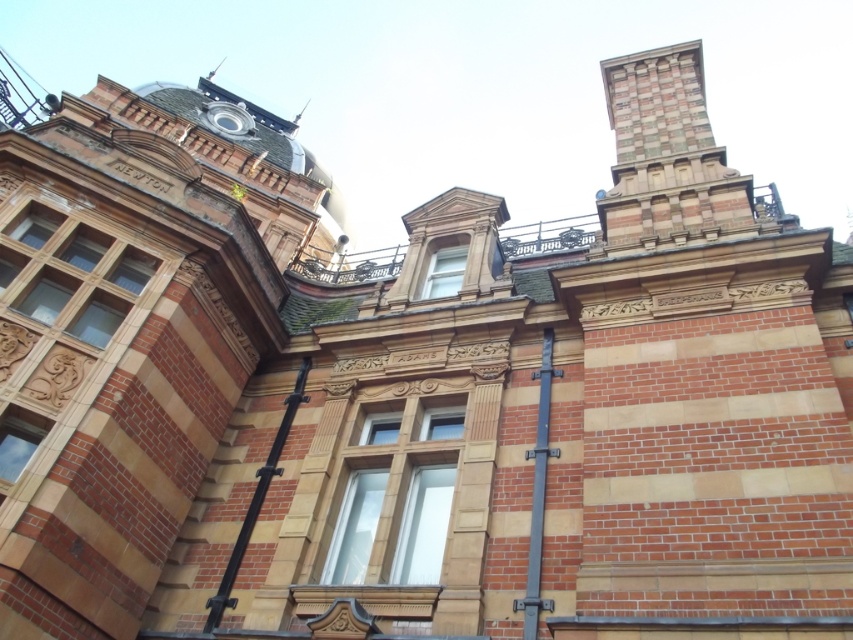
Question: Does matte glass window at center have a lesser width compared to clear glass window at lower left?

Choices:
 (A) no
 (B) yes

Answer: (A)

Question: Among these objects, which one is nearest to the camera?

Choices:
 (A) matte glass window at center
 (B) clear glass window at upper center
 (C) black metal pole at lower left

Answer: (C)

Question: Which object is positioned closest to the black metal pole at lower left?

Choices:
 (A) brown wooden window at upper left
 (B) clear glass window at upper center

Answer: (B)

Question: Does black metal pole at center-right come behind black metal pole at lower left?

Choices:
 (A) yes
 (B) no

Answer: (B)

Question: Which point appears farthest from the camera in this image?

Choices:
 (A) (28, 417)
 (B) (387, 426)

Answer: (B)

Question: Is brown wooden window at upper left to the right of clear glass window at lower left from the viewer's perspective?

Choices:
 (A) yes
 (B) no

Answer: (B)